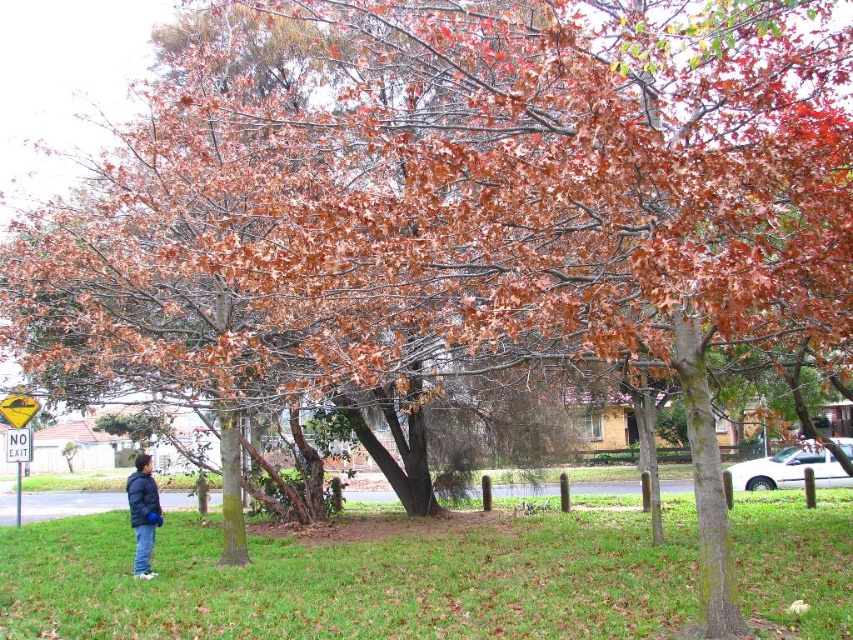
You are standing in the suburban autumn scene and see the green grass at lower center and the dark blue jacket at lower left. Which object is positioned lower in the image?

The green grass at lower center is positioned lower than the dark blue jacket at lower left in the image.